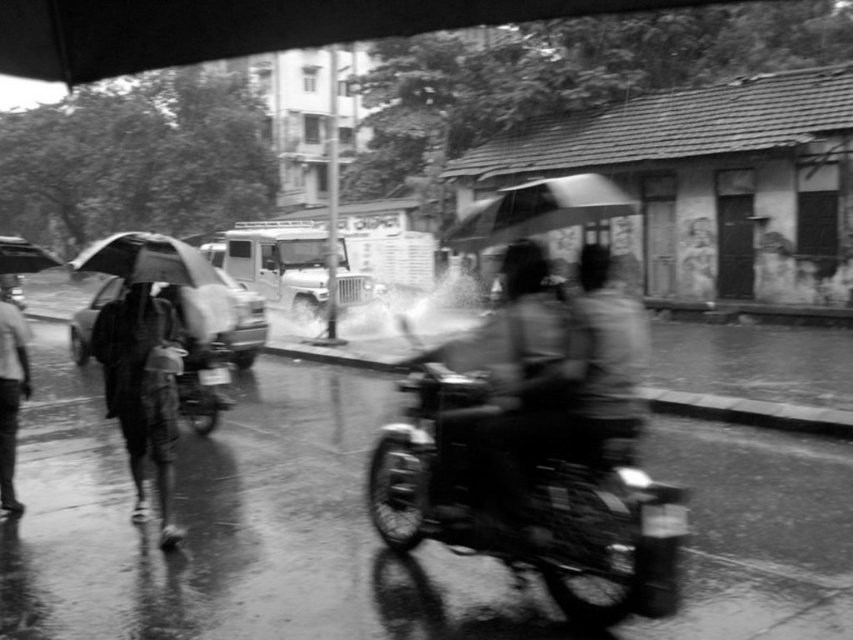
Question: Among these points, which one is nearest to the camera?

Choices:
 (A) (3, 332)
 (B) (155, 474)
 (C) (502, 364)
 (D) (585, 429)

Answer: (D)

Question: Which point is closer to the camera?

Choices:
 (A) (538, 227)
 (B) (151, 403)

Answer: (A)

Question: Is blurred fabric umbrella at center above transparent plastic umbrella at center?

Choices:
 (A) yes
 (B) no

Answer: (B)

Question: Can you confirm if blurred fabric umbrella at center is positioned to the left of transparent plastic umbrella at upper left?

Choices:
 (A) yes
 (B) no

Answer: (B)

Question: Estimate the real-world distances between objects in this image. Which object is farther from the blurred fabric umbrella at center?

Choices:
 (A) transparent plastic umbrella at upper left
 (B) metallic dark gray motorcycle at center
 (C) transparent plastic umbrella at center
 (D) dark matte umbrella at left

Answer: (D)

Question: Does dark matte umbrella at left appear on the left side of transparent plastic umbrella at upper left?

Choices:
 (A) no
 (B) yes

Answer: (A)